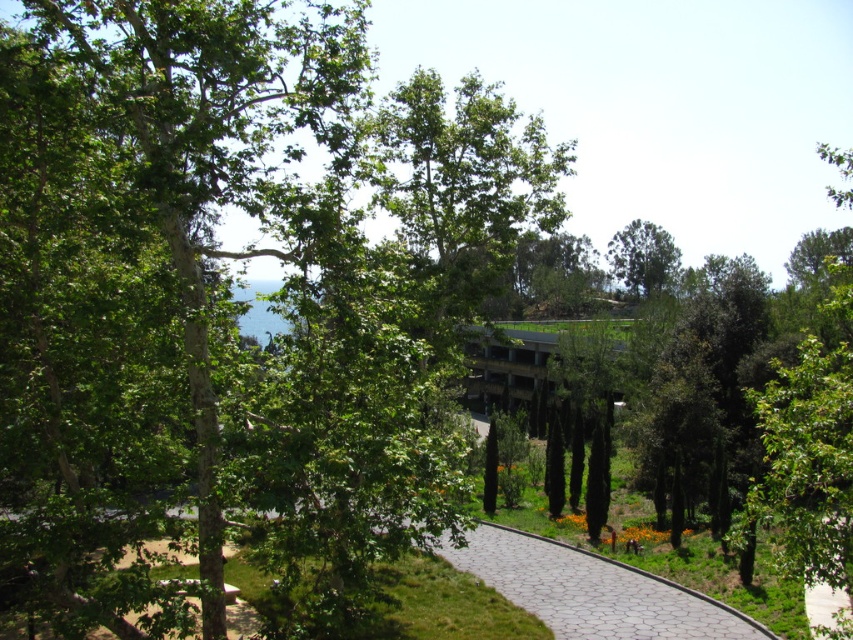
Question: Based on their relative distances, which object is nearer to the green leafy tree at left?

Choices:
 (A) green leafy tree at upper center
 (B) paved stone path at center

Answer: (B)

Question: Can you confirm if green leafy tree at left is thinner than green leafy tree at upper center?

Choices:
 (A) yes
 (B) no

Answer: (B)

Question: Which point is farther from the camera taking this photo?

Choices:
 (A) (286, 35)
 (B) (645, 220)
 (C) (463, 609)

Answer: (B)

Question: Can you confirm if green leafy tree at left is bigger than green leafy tree at upper center?

Choices:
 (A) no
 (B) yes

Answer: (B)

Question: Can you confirm if green leafy tree at left is wider than green leafy tree at upper center?

Choices:
 (A) yes
 (B) no

Answer: (A)

Question: Among these points, which one is nearest to the camera?

Choices:
 (A) (643, 250)
 (B) (509, 586)

Answer: (B)